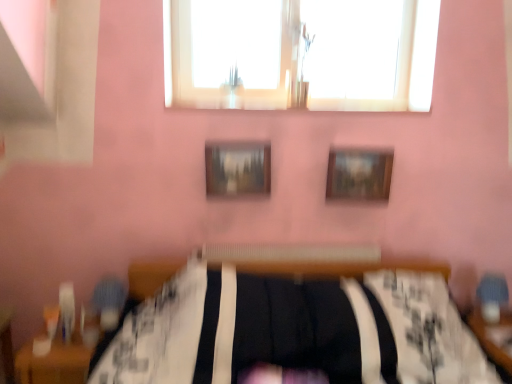
This screenshot has height=384, width=512. Describe the element at coordinates (359, 174) in the screenshot. I see `wooden picture frame at upper center, which appears as the first picture frame when viewed from the right` at that location.

This screenshot has height=384, width=512. Describe the element at coordinates (494, 337) in the screenshot. I see `wooden table at lower right, the 2th table from the left` at that location.

You are a GUI agent. You are given a task and a screenshot of the screen. Output one action in this format:
    pyautogui.click(x=<x>, y=<y>)
    Task: Click on the transparent glass window at upper center
    The image size is (512, 384).
    Given the screenshot: What is the action you would take?
    pyautogui.click(x=300, y=54)

This screenshot has height=384, width=512. In order to click on wooden table at lower left, positioned as the 1th table in left-to-right order in this screenshot , I will do `click(54, 362)`.

Is wooden table at lower right, placed as the 1th table when sorted from right to left, aimed at wooden picture frame at upper center, the second picture frame when ordered from left to right?

No, wooden table at lower right, placed as the 1th table when sorted from right to left, does not turn towards wooden picture frame at upper center, the second picture frame when ordered from left to right.

Is wooden table at lower right, placed as the 1th table when sorted from right to left, located outside wooden picture frame at upper center, the second picture frame when ordered from left to right?

That's correct, wooden table at lower right, placed as the 1th table when sorted from right to left, is outside of wooden picture frame at upper center, the second picture frame when ordered from left to right.

Can you confirm if wooden table at lower right, the 2th table from the left, is taller than wooden picture frame at upper center, which appears as the first picture frame when viewed from the right?

Yes, wooden table at lower right, the 2th table from the left, is taller than wooden picture frame at upper center, which appears as the first picture frame when viewed from the right.

Can you confirm if wooden table at lower right, placed as the 1th table when sorted from right to left, is shorter than wooden table at lower left, positioned as the 2th table in right-to-left order?

In fact, wooden table at lower right, placed as the 1th table when sorted from right to left, may be taller than wooden table at lower left, positioned as the 2th table in right-to-left order.

Would you consider wooden table at lower right, placed as the 1th table when sorted from right to left, to be distant from wooden table at lower left, positioned as the 2th table in right-to-left order?

Yes, wooden table at lower right, placed as the 1th table when sorted from right to left, and wooden table at lower left, positioned as the 2th table in right-to-left order, are located far from each other.

Would you say wooden table at lower right, the 2th table from the left, is to the left or to the right of wooden table at lower left, positioned as the 1th table in left-to-right order, in the picture?

From the image, it's evident that wooden table at lower right, the 2th table from the left, is to the right of wooden table at lower left, positioned as the 1th table in left-to-right order.

Considering the relative sizes of wooden table at lower right, the 2th table from the left, and wooden table at lower left, positioned as the 1th table in left-to-right order, in the image provided, is wooden table at lower right, the 2th table from the left, thinner than wooden table at lower left, positioned as the 1th table in left-to-right order,?

Indeed, wooden table at lower right, the 2th table from the left, has a lesser width compared to wooden table at lower left, positioned as the 1th table in left-to-right order.

Is transparent glass window at upper center facing away from wooden table at lower right, the 2th table from the left?

transparent glass window at upper center does not have its back to wooden table at lower right, the 2th table from the left.

Is transparent glass window at upper center located outside wooden table at lower right, the 2th table from the left?

transparent glass window at upper center is positioned outside wooden table at lower right, the 2th table from the left.

Considering the sizes of objects transparent glass window at upper center and wooden table at lower right, the 2th table from the left, in the image provided, who is smaller, transparent glass window at upper center or wooden table at lower right, the 2th table from the left,?

transparent glass window at upper center.

Which object is closer to the camera, transparent glass window at upper center or wooden table at lower right, placed as the 1th table when sorted from right to left?

wooden table at lower right, placed as the 1th table when sorted from right to left.

From the picture: Is transparent glass window at upper center wider than wooden table at lower left, positioned as the 2th table in right-to-left order?

Incorrect, the width of transparent glass window at upper center does not surpass that of wooden table at lower left, positioned as the 2th table in right-to-left order.

From a real-world perspective, is transparent glass window at upper center positioned above or below wooden table at lower left, positioned as the 1th table in left-to-right order?

transparent glass window at upper center is situated higher than wooden table at lower left, positioned as the 1th table in left-to-right order, in the real world.

Is transparent glass window at upper center surrounding wooden table at lower left, positioned as the 2th table in right-to-left order?

No, wooden table at lower left, positioned as the 2th table in right-to-left order, is not inside transparent glass window at upper center.

The height and width of the screenshot is (384, 512). I want to click on table on the left side of transparent glass window at upper center, so coord(54,362).

Between wooden table at lower right, the 2th table from the left, and transparent glass window at upper center, which one has more height?

transparent glass window at upper center is taller.

Can you confirm if wooden table at lower right, the 2th table from the left, is thinner than transparent glass window at upper center?

In fact, wooden table at lower right, the 2th table from the left, might be wider than transparent glass window at upper center.

Considering the relative positions of wooden table at lower right, placed as the 1th table when sorted from right to left, and transparent glass window at upper center in the image provided, is wooden table at lower right, placed as the 1th table when sorted from right to left, behind transparent glass window at upper center?

No, it is not.

Is wooden table at lower right, placed as the 1th table when sorted from right to left, touching transparent glass window at upper center?

There is a gap between wooden table at lower right, placed as the 1th table when sorted from right to left, and transparent glass window at upper center.

From the image's perspective, between transparent glass window at upper center and wooden picture frame at upper center, which appears as the first picture frame when viewed from the right, who is located below?

wooden picture frame at upper center, which appears as the first picture frame when viewed from the right, from the image's perspective.

Considering the sizes of objects transparent glass window at upper center and wooden picture frame at upper center, the second picture frame when ordered from left to right, in the image provided, who is thinner, transparent glass window at upper center or wooden picture frame at upper center, the second picture frame when ordered from left to right,?

wooden picture frame at upper center, the second picture frame when ordered from left to right, is thinner.

Which of these two, transparent glass window at upper center or wooden picture frame at upper center, which appears as the first picture frame when viewed from the right, is smaller?

wooden picture frame at upper center, which appears as the first picture frame when viewed from the right.

Could you measure the distance between transparent glass window at upper center and wooden picture frame at upper center, the second picture frame when ordered from left to right?

They are 64.98 centimeters apart.

Is wooden picture frame at upper center, which appears as the first picture frame when viewed from the right, closer to the viewer compared to transparent glass window at upper center?

That is True.

From the image's perspective, which object appears higher, wooden picture frame at upper center, the second picture frame when ordered from left to right, or transparent glass window at upper center?

transparent glass window at upper center appears higher in the image.

From a real-world perspective, starting from the wooden picture frame at upper center, which appears as the first picture frame when viewed from the right, which table is the 2nd one below it? Please provide its 2D coordinates.

[(494, 337)]

Locate an element on the screen. table to the right of wooden table at lower left, positioned as the 1th table in left-to-right order is located at coordinates (494, 337).

Estimate the real-world distances between objects in this image. Which object is closer to wooden picture frame at upper center, the second picture frame when ordered from left to right, wooden textured picture frame at center, acting as the second picture frame starting from the right, or wooden table at lower right, placed as the 1th table when sorted from right to left?

wooden textured picture frame at center, acting as the second picture frame starting from the right, is closer to wooden picture frame at upper center, the second picture frame when ordered from left to right.

Which object lies further to the anchor point wooden table at lower left, positioned as the 2th table in right-to-left order, wooden picture frame at upper center, which appears as the first picture frame when viewed from the right, or wooden table at lower right, the 2th table from the left?

wooden table at lower right, the 2th table from the left, is further to wooden table at lower left, positioned as the 2th table in right-to-left order.

Which object lies further to the anchor point transparent glass window at upper center, wooden table at lower left, positioned as the 2th table in right-to-left order, or wooden textured picture frame at center, positioned as the first picture frame in left-to-right order?

wooden table at lower left, positioned as the 2th table in right-to-left order, is further to transparent glass window at upper center.

Estimate the real-world distances between objects in this image. Which object is further from wooden picture frame at upper center, which appears as the first picture frame when viewed from the right, wooden table at lower left, positioned as the 1th table in left-to-right order, or transparent glass window at upper center?

Based on the image, wooden table at lower left, positioned as the 1th table in left-to-right order, appears to be further to wooden picture frame at upper center, which appears as the first picture frame when viewed from the right.

Estimate the real-world distances between objects in this image. Which object is further from wooden textured picture frame at center, positioned as the first picture frame in left-to-right order, wooden table at lower left, positioned as the 1th table in left-to-right order, or wooden picture frame at upper center, which appears as the first picture frame when viewed from the right?

wooden table at lower left, positioned as the 1th table in left-to-right order, is positioned further to the anchor wooden textured picture frame at center, positioned as the first picture frame in left-to-right order.

Estimate the real-world distances between objects in this image. Which object is closer to transparent glass window at upper center, wooden textured picture frame at center, acting as the second picture frame starting from the right, or wooden picture frame at upper center, which appears as the first picture frame when viewed from the right?

Answer: wooden textured picture frame at center, acting as the second picture frame starting from the right, lies closer to transparent glass window at upper center than the other object.

From the image, which object appears to be nearer to wooden table at lower right, placed as the 1th table when sorted from right to left, wooden table at lower left, positioned as the 1th table in left-to-right order, or wooden textured picture frame at center, acting as the second picture frame starting from the right?

Among the two, wooden textured picture frame at center, acting as the second picture frame starting from the right, is located nearer to wooden table at lower right, placed as the 1th table when sorted from right to left.

Looking at the image, which one is located further to transparent glass window at upper center, wooden picture frame at upper center, the second picture frame when ordered from left to right, or wooden table at lower left, positioned as the 1th table in left-to-right order?

The object further to transparent glass window at upper center is wooden table at lower left, positioned as the 1th table in left-to-right order.

Where is `picture frame between wooden textured picture frame at center, acting as the second picture frame starting from the right, and wooden table at lower right, the 2th table from the left`? The image size is (512, 384). picture frame between wooden textured picture frame at center, acting as the second picture frame starting from the right, and wooden table at lower right, the 2th table from the left is located at coordinates (359, 174).

Identify the location of picture frame between wooden table at lower left, positioned as the 1th table in left-to-right order, and wooden picture frame at upper center, which appears as the first picture frame when viewed from the right, in the horizontal direction. This screenshot has height=384, width=512. (237, 169).

Identify the location of window between wooden table at lower left, positioned as the 1th table in left-to-right order, and wooden table at lower right, placed as the 1th table when sorted from right to left, in the horizontal direction. This screenshot has width=512, height=384. (300, 54).

The width and height of the screenshot is (512, 384). Find the location of `picture frame between transparent glass window at upper center and wooden picture frame at upper center, the second picture frame when ordered from left to right, vertically`. picture frame between transparent glass window at upper center and wooden picture frame at upper center, the second picture frame when ordered from left to right, vertically is located at coordinates (237, 169).